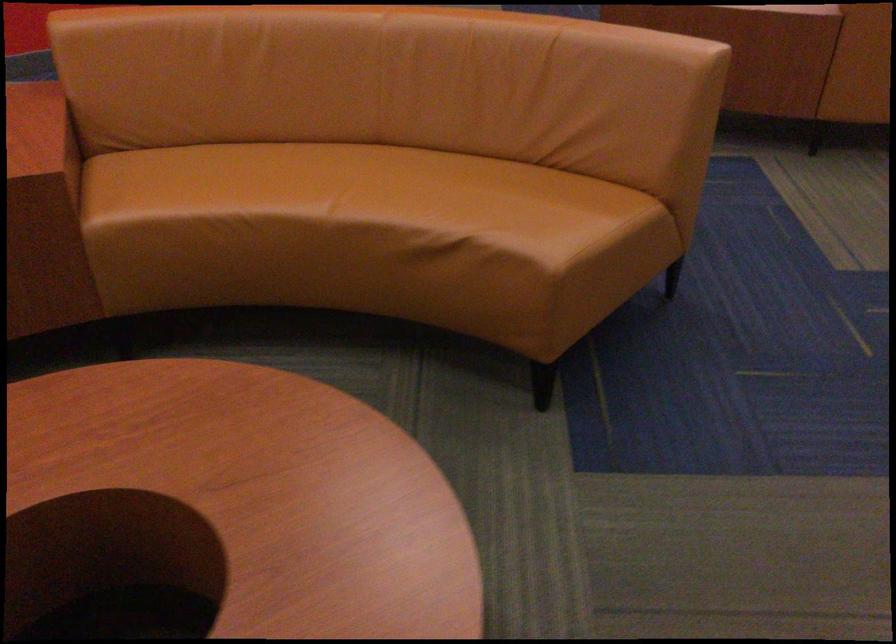
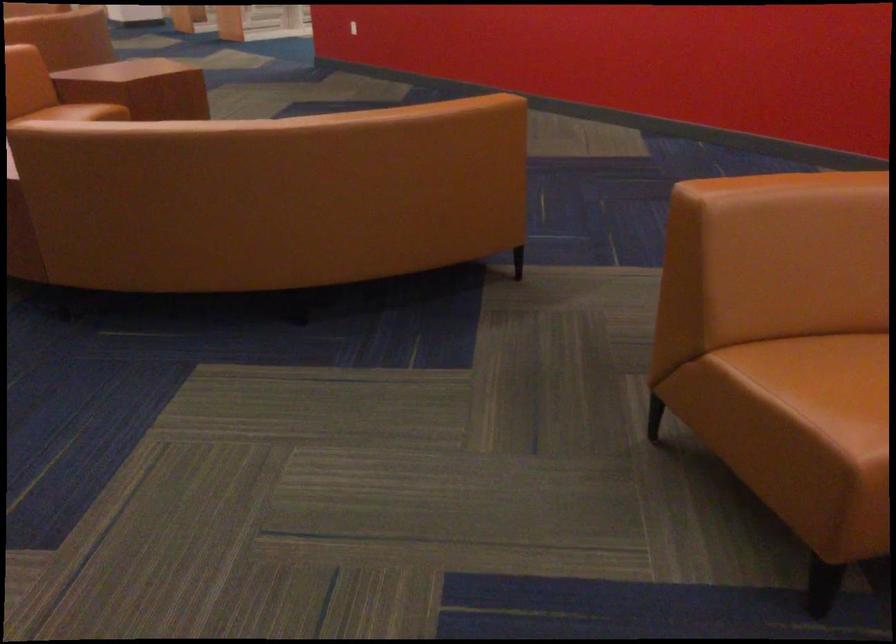
The images are taken continuously from a first-person perspective. In which direction is your viewpoint rotating?

The camera's rotation is toward left-down.